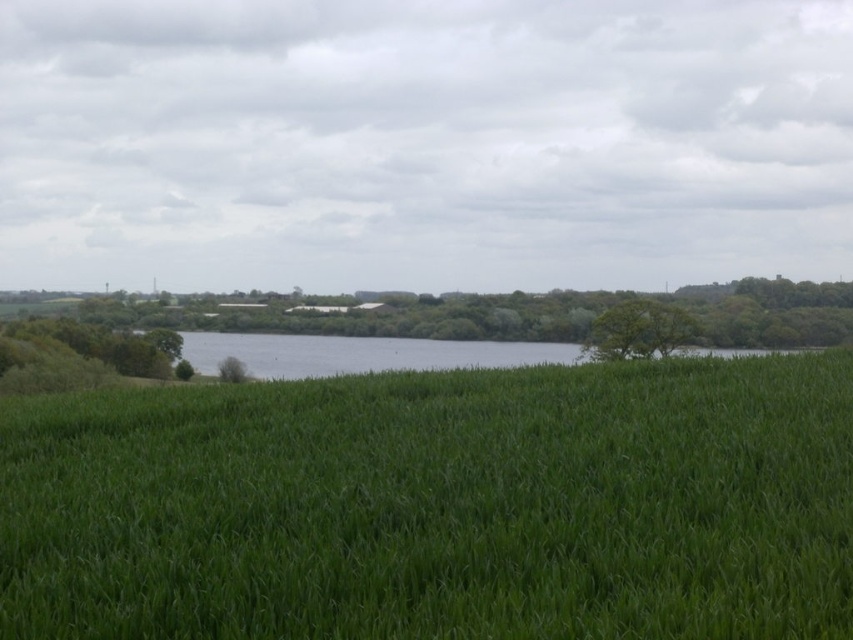
Is clear water at center thinner than green leafy tree at right?

In fact, clear water at center might be wider than green leafy tree at right.

What do you see at coordinates (360, 353) in the screenshot? I see `clear water at center` at bounding box center [360, 353].

Where is `clear water at center`? The image size is (853, 640). clear water at center is located at coordinates (360, 353).

Is clear water at center above green leafy tree at lower left?

No, clear water at center is not above green leafy tree at lower left.

Between clear water at center and green leafy tree at lower left, which one is positioned higher?

green leafy tree at lower left is above.

What do you see at coordinates (360, 353) in the screenshot? The height and width of the screenshot is (640, 853). I see `clear water at center` at bounding box center [360, 353].

Image resolution: width=853 pixels, height=640 pixels. Find the location of `clear water at center`. clear water at center is located at coordinates (360, 353).

Is point (51, 348) positioned after point (618, 308)?

That is True.

Does green leafy tree at lower left have a smaller size compared to green leafy tree at right?

No, green leafy tree at lower left is not smaller than green leafy tree at right.

Is point (18, 349) farther from camera compared to point (607, 355)?

Yes.

You are a GUI agent. You are given a task and a screenshot of the screen. Output one action in this format:
    pyautogui.click(x=<x>, y=<y>)
    Task: Click on the green leafy tree at lower left
    This screenshot has width=853, height=640.
    Given the screenshot: What is the action you would take?
    pyautogui.click(x=73, y=356)